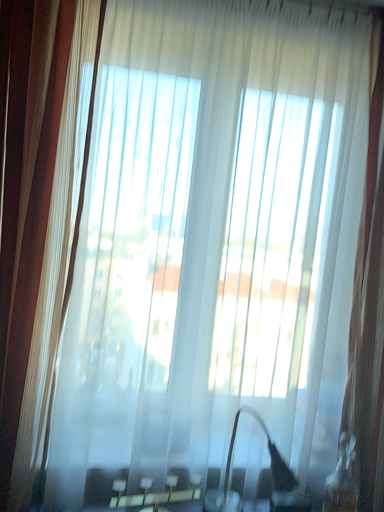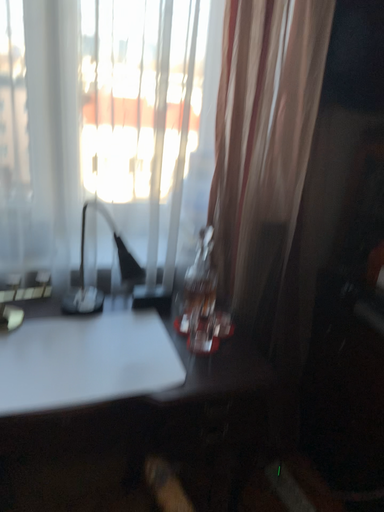
Question: Which way did the camera rotate in the video?

Choices:
 (A) rotated upward
 (B) rotated downward

Answer: (B)